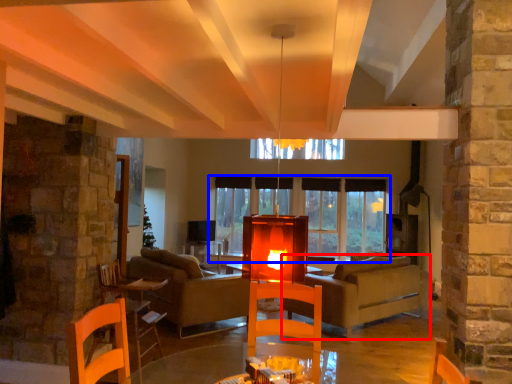
Question: Which of the following is the farthest to the observer, studio couch (highlighted by a red box) or window (highlighted by a blue box)?

Choices:
 (A) studio couch
 (B) window

Answer: (B)